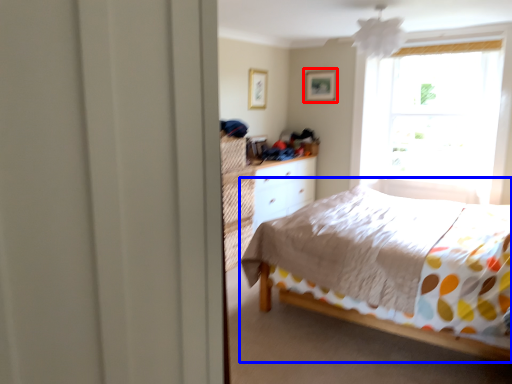
Question: Which of the following is the closest to the observer, picture frame (highlighted by a red box) or bed (highlighted by a blue box)?

Choices:
 (A) picture frame
 (B) bed

Answer: (B)